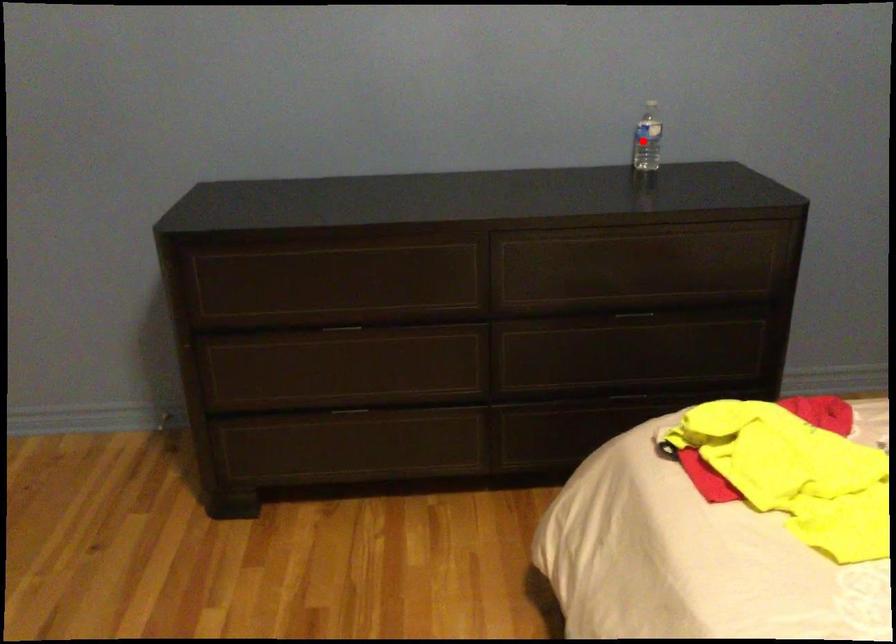
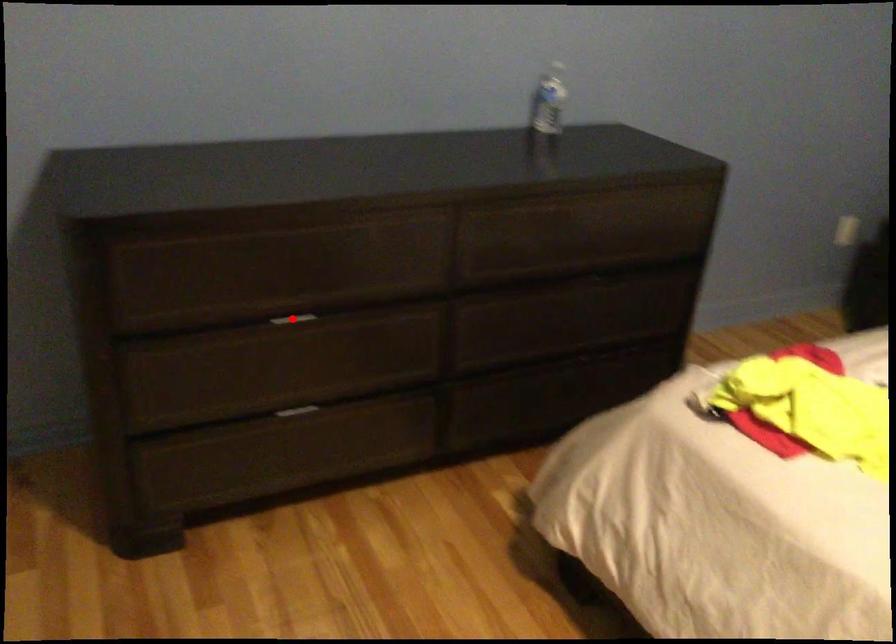
I am providing you with two images of the same scene from different viewpoints. A red point is marked on the first image and another point is marked on the second image. Do the highlighted points in image1 and image2 indicate the same real-world spot?

No